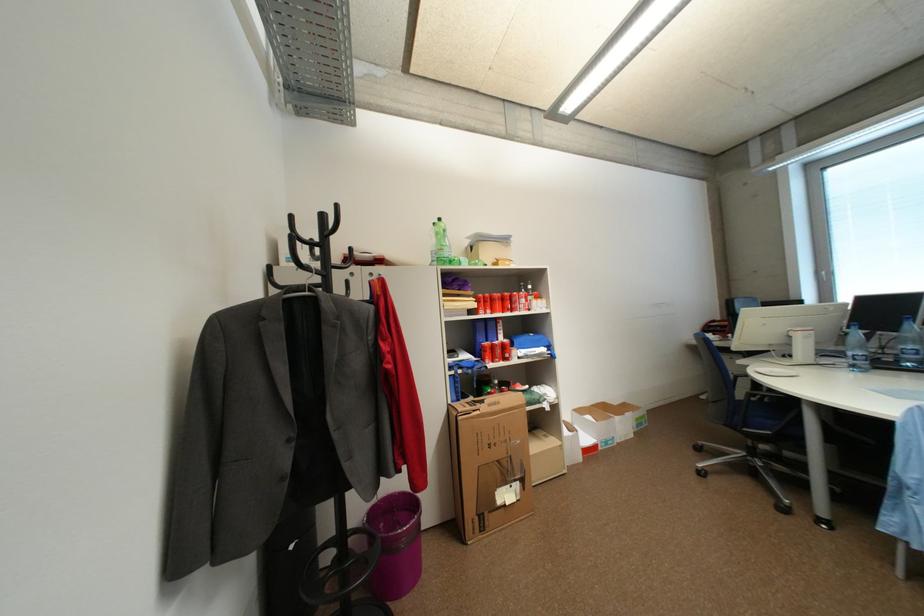
At what (x,y) coordinates should I click in order to perform the action: click on black coat rack hook. Please return your answer as a coordinate pair (x, y). This screenshot has height=616, width=924. Looking at the image, I should click on (329, 222).